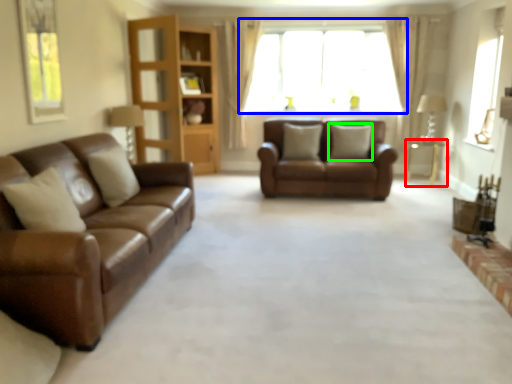
Question: Estimate the real-world distances between objects in this image. Which object is farther from table (highlighted by a red box), window (highlighted by a blue box) or pillow (highlighted by a green box)?

Choices:
 (A) window
 (B) pillow

Answer: (A)